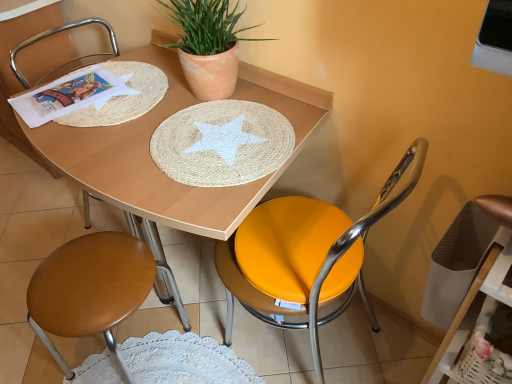
Locate an element on the screen. Image resolution: width=512 pixels, height=384 pixels. vacant space underneath brown leather stool at lower left, positioned as the second chair in left-to-right order (from a real-world perspective) is located at coordinates (129, 357).